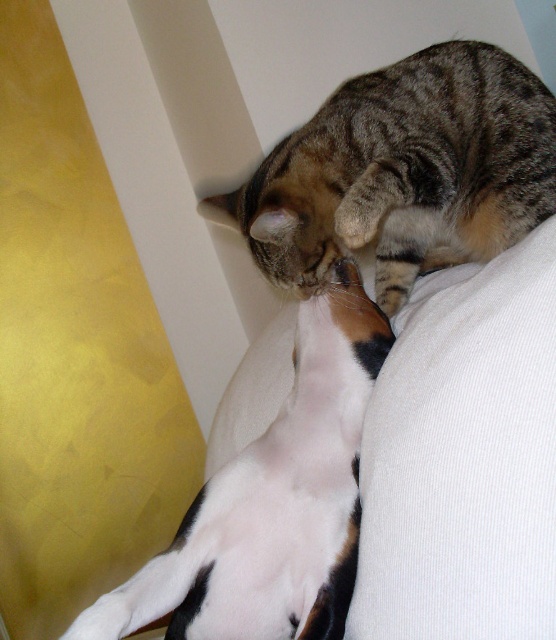
Question: Is tabby fur cat at upper center thinner than white fur cat at center?

Choices:
 (A) yes
 (B) no

Answer: (B)

Question: Is tabby fur cat at upper center thinner than white fur cat at center?

Choices:
 (A) no
 (B) yes

Answer: (A)

Question: Considering the relative positions of tabby fur cat at upper center and white fur cat at center in the image provided, where is tabby fur cat at upper center located with respect to white fur cat at center?

Choices:
 (A) below
 (B) above

Answer: (B)

Question: Which point is closer to the camera?

Choices:
 (A) white fur cat at center
 (B) tabby fur cat at upper center

Answer: (A)